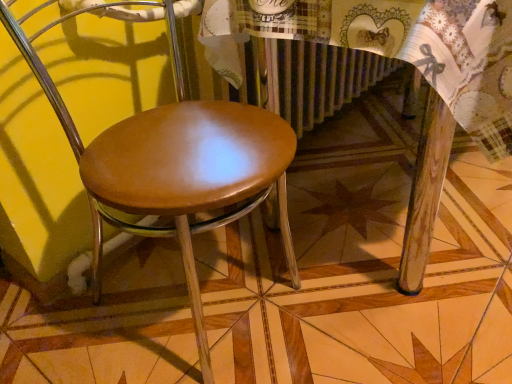
Question: Does shiny brown wood chair at center have a greater width compared to wooden table at center?

Choices:
 (A) yes
 (B) no

Answer: (B)

Question: From the image's perspective, is shiny brown wood chair at center on wooden table at center?

Choices:
 (A) no
 (B) yes

Answer: (A)

Question: Considering the relative sizes of shiny brown wood chair at center and wooden table at center in the image provided, is shiny brown wood chair at center bigger than wooden table at center?

Choices:
 (A) yes
 (B) no

Answer: (B)

Question: Would you say shiny brown wood chair at center is outside wooden table at center?

Choices:
 (A) no
 (B) yes

Answer: (B)

Question: Does shiny brown wood chair at center appear on the left side of wooden table at center?

Choices:
 (A) yes
 (B) no

Answer: (A)

Question: From the image's perspective, would you say shiny brown wood chair at center is shown under wooden table at center?

Choices:
 (A) yes
 (B) no

Answer: (A)

Question: From a real-world perspective, is wooden table at center positioned under shiny brown wood chair at center based on gravity?

Choices:
 (A) no
 (B) yes

Answer: (B)

Question: Can you confirm if wooden table at center is shorter than shiny brown wood chair at center?

Choices:
 (A) no
 (B) yes

Answer: (B)

Question: Is wooden table at center in contact with shiny brown wood chair at center?

Choices:
 (A) yes
 (B) no

Answer: (B)

Question: Is wooden table at center far away from shiny brown wood chair at center?

Choices:
 (A) no
 (B) yes

Answer: (A)

Question: Is shiny brown wood chair at center at the back of wooden table at center?

Choices:
 (A) no
 (B) yes

Answer: (A)

Question: Is wooden table at center located outside shiny brown wood chair at center?

Choices:
 (A) no
 (B) yes

Answer: (B)

Question: Considering the positions of point (96, 145) and point (336, 9), is point (96, 145) closer or farther from the camera than point (336, 9)?

Choices:
 (A) closer
 (B) farther

Answer: (B)